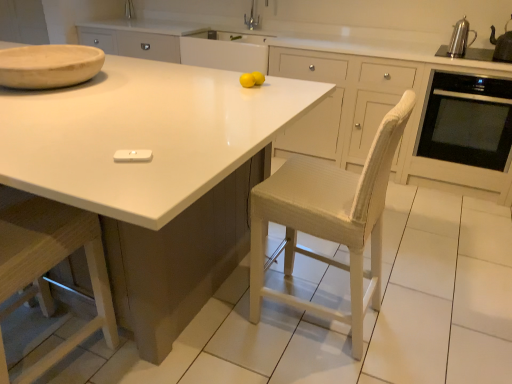
Question: Is silver metallic faucet at upper center in front of or behind black glass oven at right in the image?

Choices:
 (A) front
 (B) behind

Answer: (B)

Question: In terms of width, does silver metallic faucet at upper center look wider or thinner when compared to black glass oven at right?

Choices:
 (A) thin
 (B) wide

Answer: (A)

Question: Which is farther from the polished stainless steel kettle at upper right?

Choices:
 (A) metallic silver kettle at upper right, which is the 1th appliance in top-to-bottom order
 (B) natural wood bowl at upper left
 (C) white glossy countertop at center
 (D) white matte remote control at center, which appears as the first appliance when viewed from the front
 (E) black glass oven at right

Answer: (D)

Question: Estimate the real-world distances between objects in this image. Which object is farther from the silver metallic faucet at upper center?

Choices:
 (A) metallic silver kettle at upper right, which is the 1th appliance in top-to-bottom order
 (B) white matte remote control at center, the 2th appliance in the right-to-left sequence
 (C) wooden at left
 (D) white glossy countertop at center
 (E) black glass oven at right

Answer: (C)